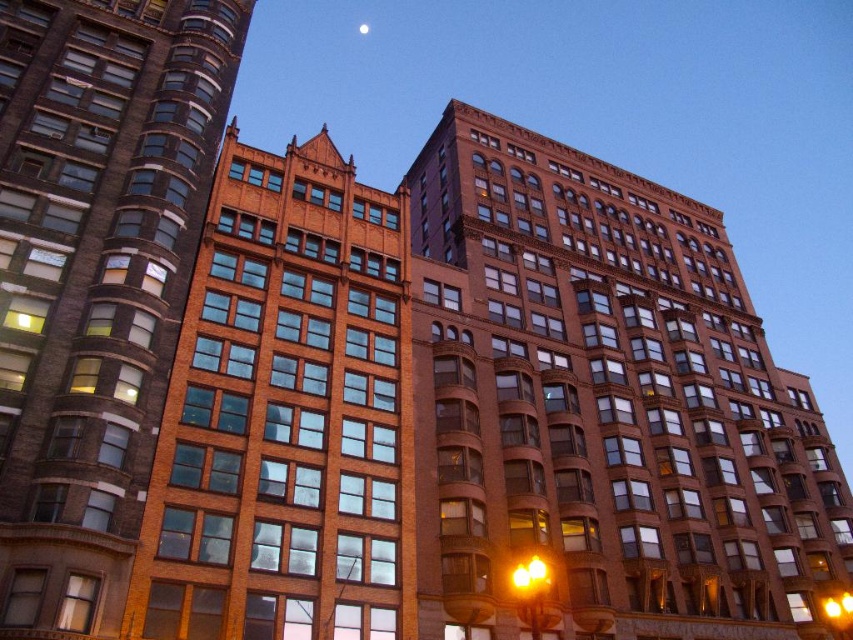
You are standing in the urban scene and want to take a photo of both point (688, 276) and point (361, 26). Which point will appear larger in the photo?

Point (688, 276) will appear larger in the photo because it is closer to the camera than point (361, 26).

You are standing in the urban scene and want to take a photo of the brown brick building at center. If your camera has a focal length of 50mm and you are 143.54 feet away from the building, what is the approximate angle of view required to capture the entire building in one frame?

The brown brick building at center is 143.54 feet away from the viewer. To calculate the angle of view, you would need to know the building height and use trigonometric functions, but since the height isn

You are standing at the center of the image and want to locate the brown brick building at center. According to the coordinates given, in which direction should you move to find it?

The brown brick building at center is located at coordinates point (602, 406). Since you are at the center, which is point (426, 320), you should move towards the lower right direction to reach it.